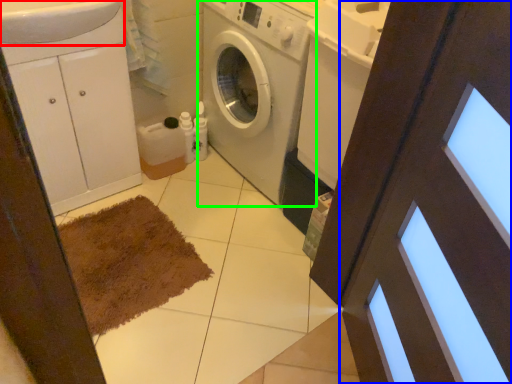
Question: Which object is the farthest from sink (highlighted by a red box)? Choose among these: screen door (highlighted by a blue box) or washing machine (highlighted by a green box).

Choices:
 (A) screen door
 (B) washing machine

Answer: (A)